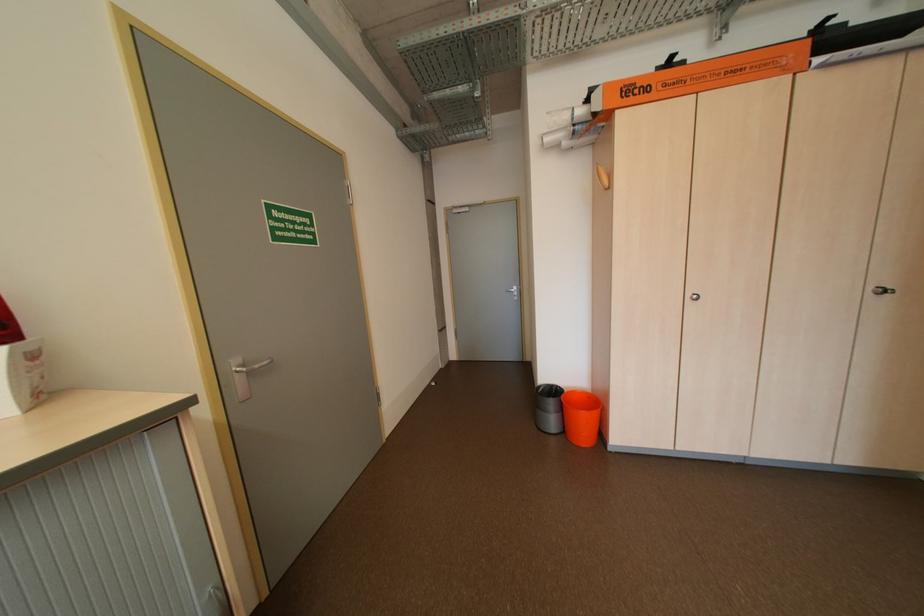
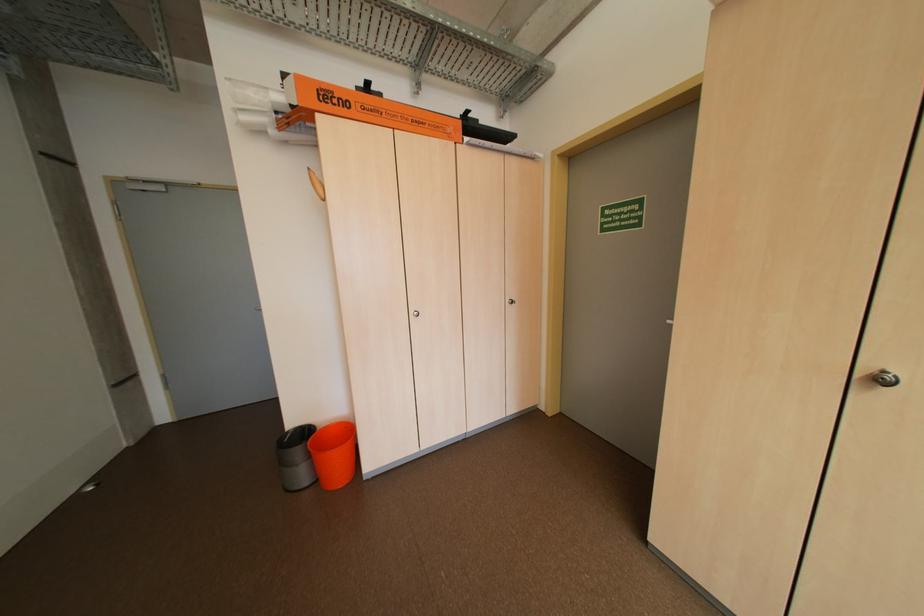
In the second image, find the point that corresponds to pixel 582 392 in the first image.

(335, 429)